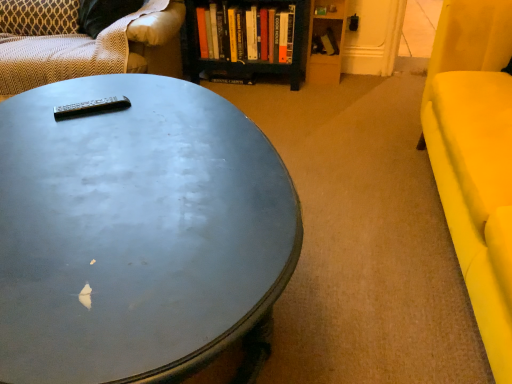
Where is `unoccupied area behind black plastic remote at center`? This screenshot has height=384, width=512. unoccupied area behind black plastic remote at center is located at coordinates (120, 87).